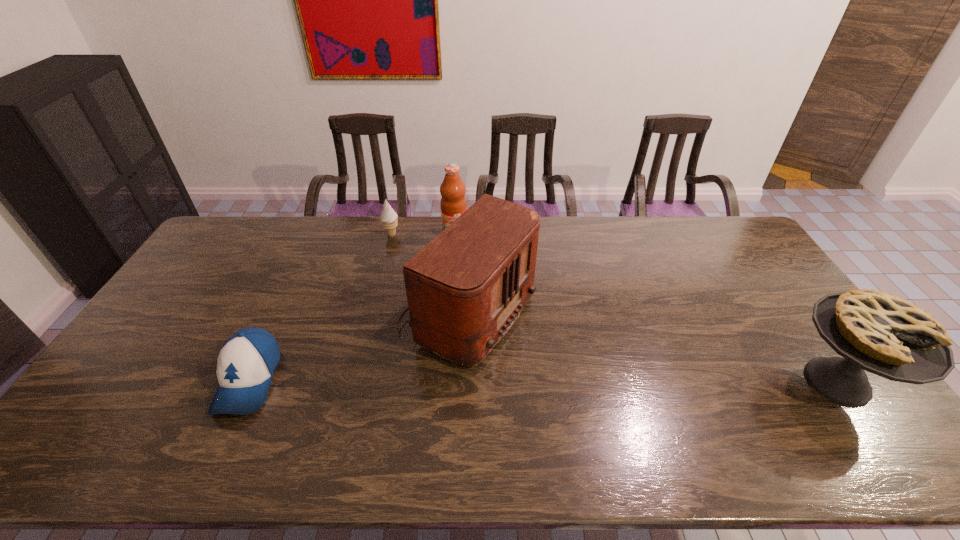
Find the location of a particular element. The height and width of the screenshot is (540, 960). free space on the desktop that is between the leftmost object and the rightmost object and is positioned on the front label of the fruit juice is located at coordinates (493, 381).

Locate an element on the screen. The image size is (960, 540). vacant spot on the desktop that is between the leftmost object and the pie and is positioned on the front panel of the radio receiver is located at coordinates (606, 381).

You are a GUI agent. You are given a task and a screenshot of the screen. Output one action in this format:
    pyautogui.click(x=<x>, y=<y>)
    Task: Click on the vacant space on the desktop that is between the baseball cap and the rightmost object and is positioned on the front-facing side of the second shortest object
    The image size is (960, 540).
    Given the screenshot: What is the action you would take?
    pyautogui.click(x=500, y=381)